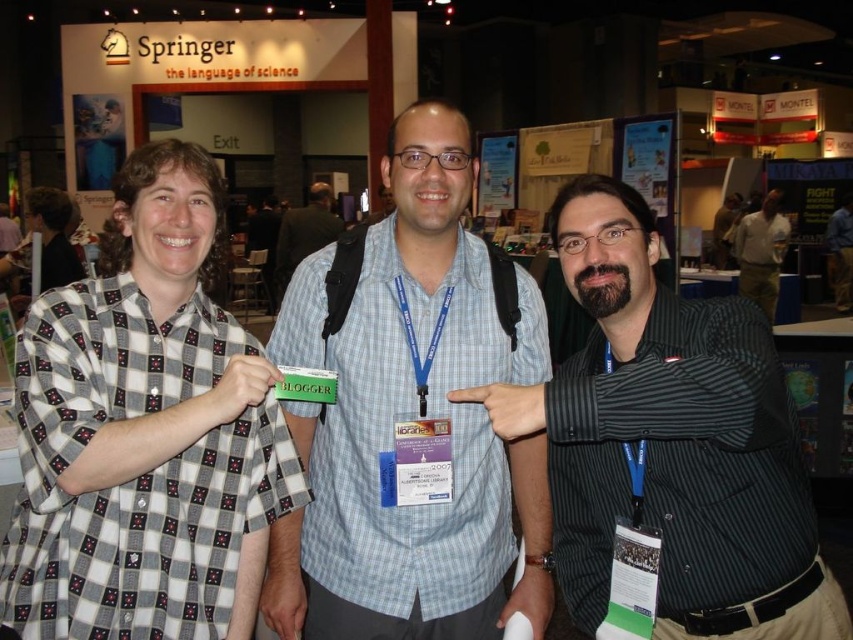
You are at a convention and see two people in the center wearing striped shirt at center and blue shirt at center. Which one is more to the left?

The striped shirt at center is more to the left than the blue shirt at center.

You are a photographer at the event and need to ensure all participants are visible in the photo. Since the white cotton shirt at center and the light blue checkered shirt at center are overlapping, which one should you ask to move back so the other is fully visible?

The white cotton shirt at center is in front of the light blue checkered shirt at center, so you should ask the light blue checkered shirt at center to move back so the white cotton shirt at center is fully visible.